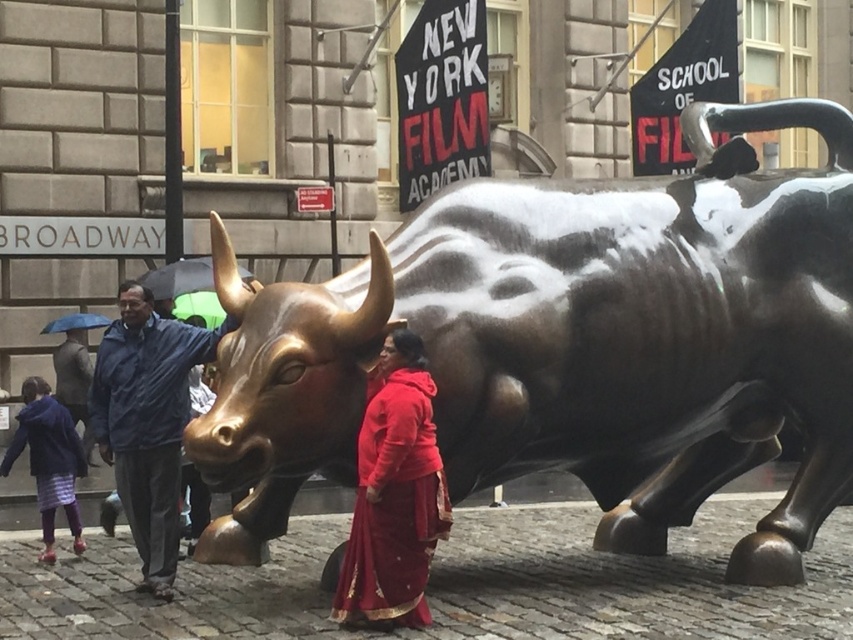
You are standing at the entrance of the building with the Broadway sign. You want to take a photo of the bronze bull at center from the best possible angle. According to the coordinates provided in the Objects Description, in which direction should you walk to position yourself optimally for the shot?

To capture the bronze bull at center optimally, you should position yourself at point (573,344) as indicated by the coordinates in the Objects Description.

You are a photographer planning to take a photo of the bronze bull at center and the red satin dress at center. Since both are in the center, how can you ensure both are visible in the frame?

The bronze bull at center is positioned over the red satin dress at center, so you should adjust your angle or zoom out slightly to capture both the bull and the dress without one blocking the other.

You are standing in front of the bronze bull sculpture in the bustling urban scene. There are two points marked on the bull, one at point coordinates point (392, 356) and another at point coordinates point (212, 337). Which point is closer to you?

Point (392, 356) is closer to the viewer than point (212, 337).